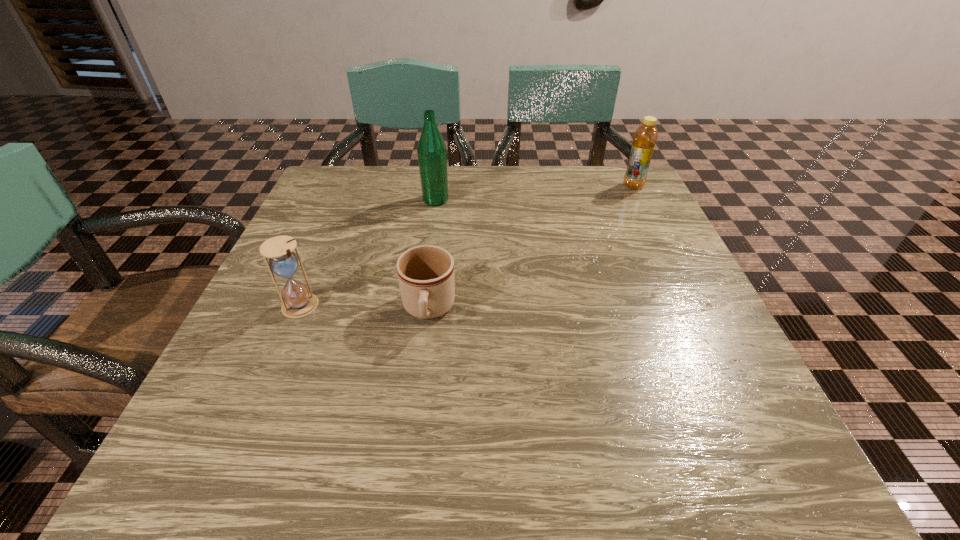
Locate an element on the screen. This screenshot has height=540, width=960. the nearer bottle is located at coordinates (432, 153).

Identify the location of the tallest object. The image size is (960, 540). (432, 153).

Identify the location of the shorter bottle. Image resolution: width=960 pixels, height=540 pixels. (645, 137).

You are a GUI agent. You are given a task and a screenshot of the screen. Output one action in this format:
    pyautogui.click(x=<x>, y=<y>)
    Task: Click on the farther bottle
    The height and width of the screenshot is (540, 960).
    Given the screenshot: What is the action you would take?
    pyautogui.click(x=645, y=137)

In order to click on hourglass in this screenshot , I will do `click(297, 302)`.

Identify the location of mug. (425, 273).

Locate an element on the screen. Image resolution: width=960 pixels, height=540 pixels. vacant space situated 0.070m on the left of the nearer bottle is located at coordinates (394, 200).

The height and width of the screenshot is (540, 960). Identify the location of vacant area situated on the front of the farthest object. (642, 205).

Where is `vacant region located on the front of the leftmost object`? The image size is (960, 540). vacant region located on the front of the leftmost object is located at coordinates (273, 370).

The image size is (960, 540). Find the location of `vacant area situated on the side of the mug with the handle`. vacant area situated on the side of the mug with the handle is located at coordinates (422, 361).